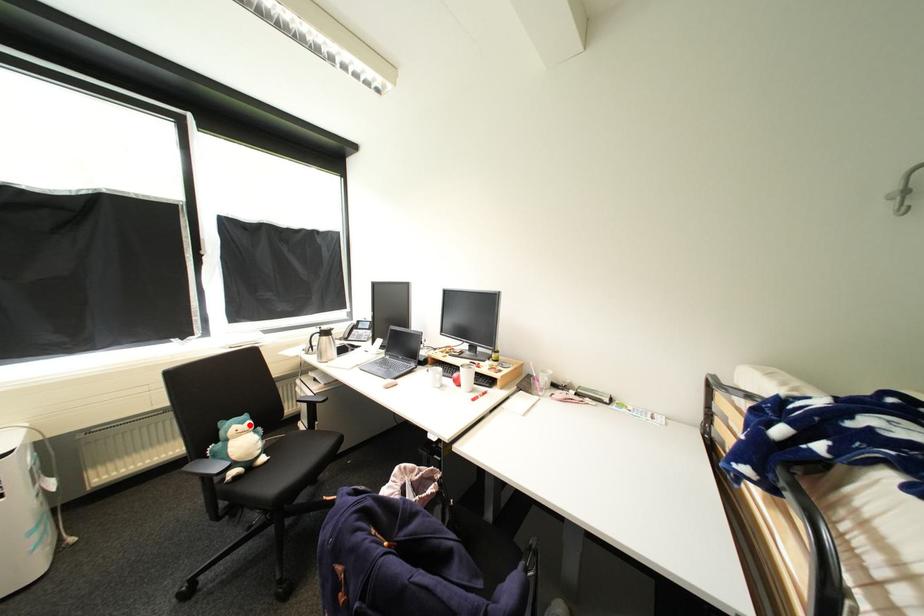
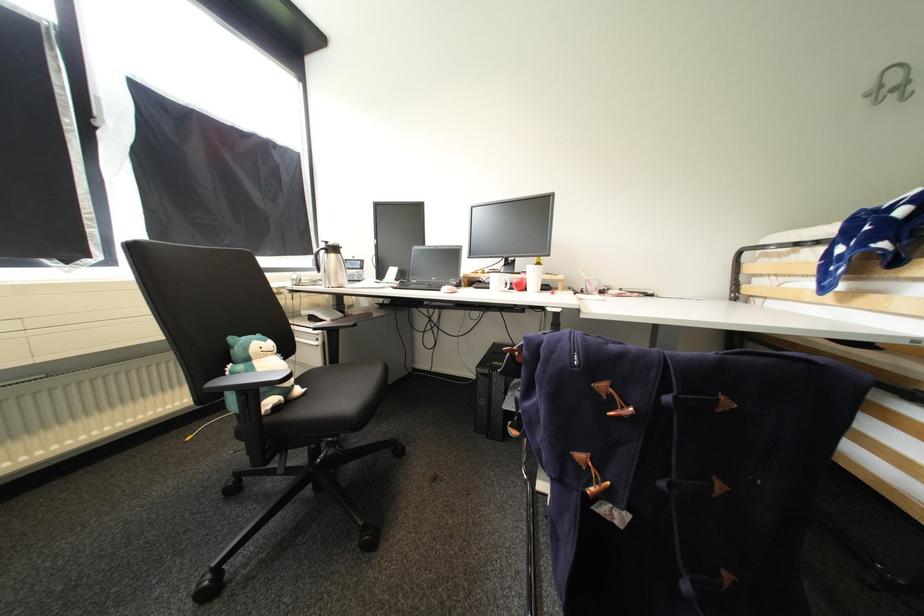
Question: I am providing you with two images of the same scene from different viewpoints. A red point is marked on the first image. At the location where the point appears in image 1, is it still visible in image 2?

Choices:
 (A) Yes
 (B) No

Answer: (A)